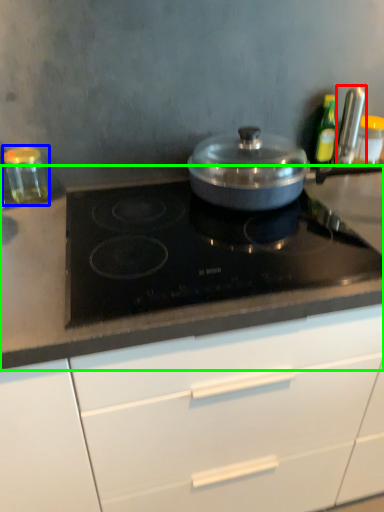
Question: Which object is the farthest from kitchen appliance (highlighted by a red box)? Choose among these: kitchen appliance (highlighted by a blue box) or countertop (highlighted by a green box).

Choices:
 (A) kitchen appliance
 (B) countertop

Answer: (A)